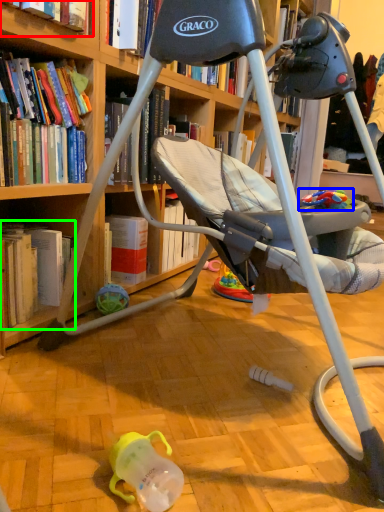
Question: Considering the real-world distances, which object is closest to book (highlighted by a red box)? toy (highlighted by a blue box) or book (highlighted by a green box).

Choices:
 (A) toy
 (B) book

Answer: (B)